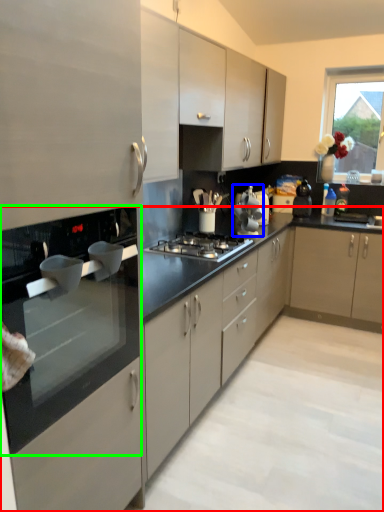
Question: Which object is positioned farthest from countertop (highlighted by a red box)? Select from appliance (highlighted by a blue box) and countertop (highlighted by a green box).

Choices:
 (A) appliance
 (B) countertop

Answer: (A)